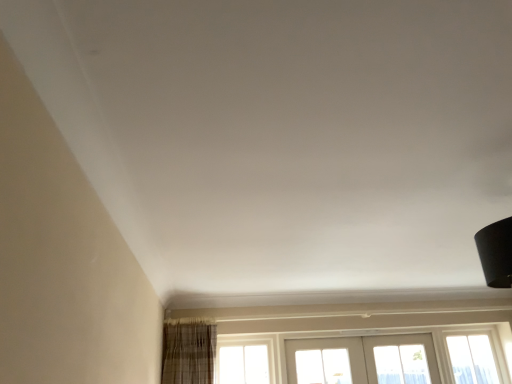
Question: Would you consider clear glass window at lower right, placed as the 1th window when sorted from right to left, to be distant from clear glass window at center, marked as the second window in a right-to-left arrangement?

Choices:
 (A) no
 (B) yes

Answer: (B)

Question: Is clear glass window at lower right, the 2th window from the left, turned away from clear glass window at center, marked as the second window in a right-to-left arrangement?

Choices:
 (A) yes
 (B) no

Answer: (B)

Question: Does clear glass window at lower right, placed as the 1th window when sorted from right to left, come in front of clear glass window at center, marked as the second window in a right-to-left arrangement?

Choices:
 (A) no
 (B) yes

Answer: (A)

Question: Would you say clear glass window at lower right, placed as the 1th window when sorted from right to left, is outside clear glass window at center, placed as the 1th window when sorted from left to right?

Choices:
 (A) no
 (B) yes

Answer: (B)

Question: Does clear glass window at lower right, placed as the 1th window when sorted from right to left, have a lesser height compared to clear glass window at center, placed as the 1th window when sorted from left to right?

Choices:
 (A) no
 (B) yes

Answer: (A)

Question: Considering the relative sizes of clear glass window at lower right, placed as the 1th window when sorted from right to left, and clear glass window at center, marked as the second window in a right-to-left arrangement, in the image provided, is clear glass window at lower right, placed as the 1th window when sorted from right to left, taller than clear glass window at center, marked as the second window in a right-to-left arrangement,?

Choices:
 (A) no
 (B) yes

Answer: (B)

Question: Considering the relative positions of clear glass window at center, placed as the 1th window when sorted from left to right, and white painted wood screen door at lower center in the image provided, is clear glass window at center, placed as the 1th window when sorted from left to right, behind white painted wood screen door at lower center?

Choices:
 (A) yes
 (B) no

Answer: (B)

Question: Can we say clear glass window at center, marked as the second window in a right-to-left arrangement, lies outside white painted wood screen door at lower center?

Choices:
 (A) no
 (B) yes

Answer: (B)

Question: Is clear glass window at center, placed as the 1th window when sorted from left to right, with white painted wood screen door at lower center?

Choices:
 (A) yes
 (B) no

Answer: (B)

Question: Does clear glass window at center, marked as the second window in a right-to-left arrangement, have a larger size compared to white painted wood screen door at lower center?

Choices:
 (A) yes
 (B) no

Answer: (B)

Question: Is clear glass window at center, marked as the second window in a right-to-left arrangement, positioned with its back to white painted wood screen door at lower center?

Choices:
 (A) yes
 (B) no

Answer: (B)

Question: Considering the relative sizes of clear glass window at center, placed as the 1th window when sorted from left to right, and white painted wood screen door at lower center in the image provided, is clear glass window at center, placed as the 1th window when sorted from left to right, smaller than white painted wood screen door at lower center?

Choices:
 (A) yes
 (B) no

Answer: (A)

Question: Is white painted wood screen door at lower center outside clear glass window at lower right, placed as the 1th window when sorted from right to left?

Choices:
 (A) yes
 (B) no

Answer: (A)